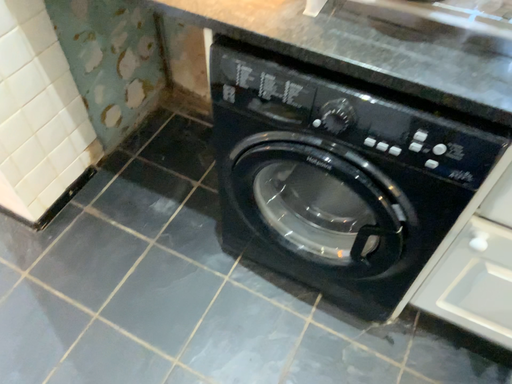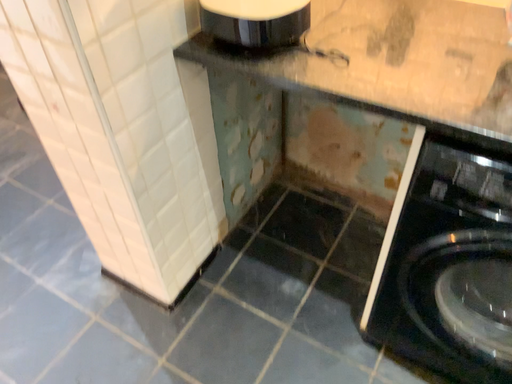
Question: How did the camera likely rotate when shooting the video?

Choices:
 (A) rotated upward
 (B) rotated downward

Answer: (A)